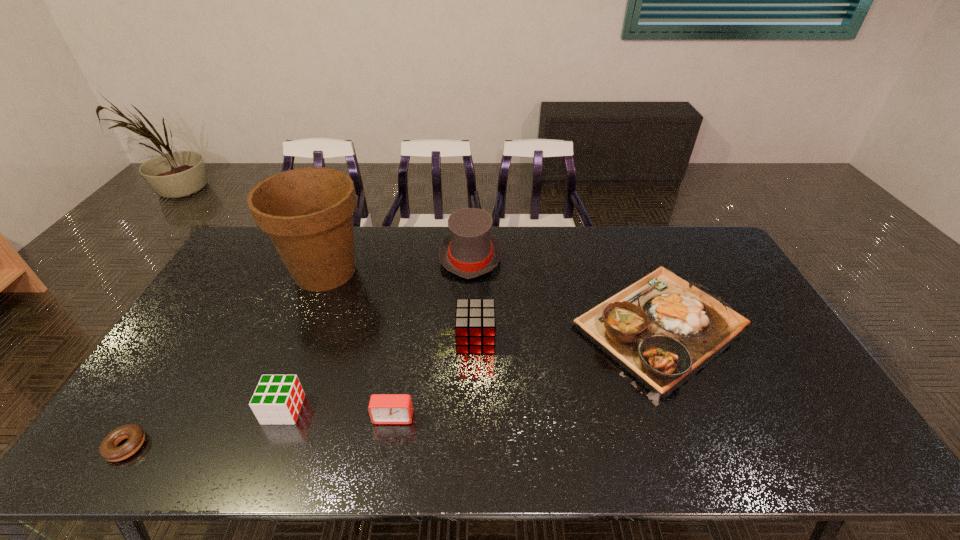
The width and height of the screenshot is (960, 540). What are the coordinates of `flowerpot` in the screenshot? It's located at (307, 212).

The width and height of the screenshot is (960, 540). Find the location of `the second tallest object`. the second tallest object is located at coordinates (469, 251).

Identify the location of the right cube. Image resolution: width=960 pixels, height=540 pixels. (475, 325).

Identify the location of the fifth shortest object. The width and height of the screenshot is (960, 540). (475, 325).

Locate an element on the screen. The image size is (960, 540). the rightmost object is located at coordinates tap(662, 329).

This screenshot has width=960, height=540. Find the location of `the shorter cube`. the shorter cube is located at coordinates (277, 399).

Find the location of a particular element. This screenshot has width=960, height=540. the nearer cube is located at coordinates (277, 399).

Where is `alarm clock`? This screenshot has width=960, height=540. alarm clock is located at coordinates (383, 408).

Find the location of `the leftmost object`. the leftmost object is located at coordinates (108, 449).

Identify the location of the nearest object. The image size is (960, 540). (108, 449).